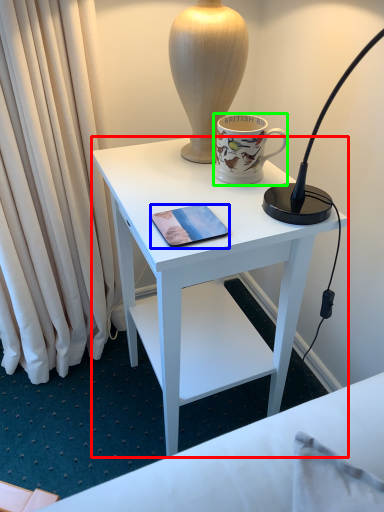
Question: Based on their relative distances, which object is nearer to desk (highlighted by a red box)? Choose from mobile phone (highlighted by a blue box) and coffee cup (highlighted by a green box).

Choices:
 (A) mobile phone
 (B) coffee cup

Answer: (B)